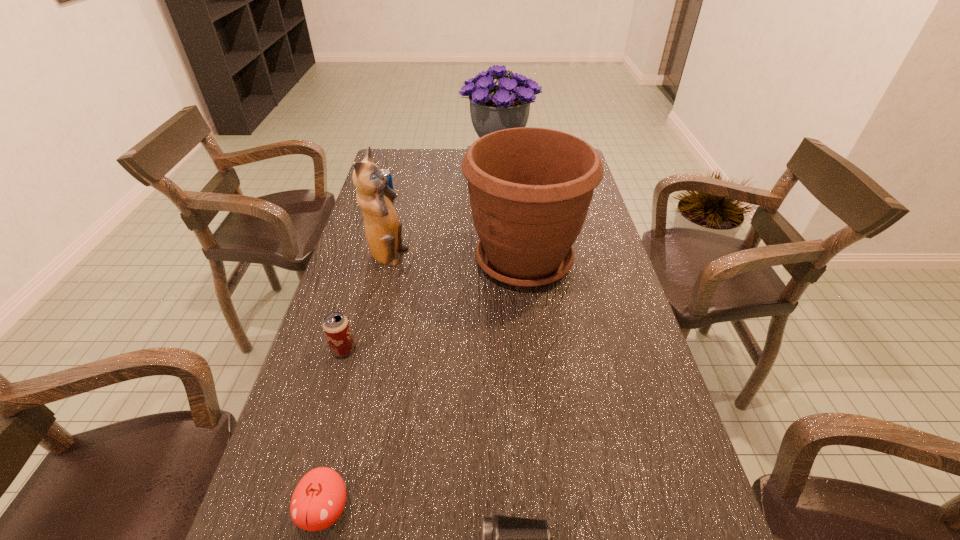
At what (x,y) coordinates should I click in order to perform the action: click on free spot between the pop soda and the flowerpot. Please return your answer as a coordinate pair (x, y). This screenshot has width=960, height=540. Looking at the image, I should click on (455, 230).

You are a GUI agent. You are given a task and a screenshot of the screen. Output one action in this format:
    pyautogui.click(x=<x>, y=<y>)
    Task: Click on the vacant space that is in between the flowerpot and the pop soda
    
    Given the screenshot: What is the action you would take?
    coord(455,230)

Image resolution: width=960 pixels, height=540 pixels. Find the location of `vacant area that lies between the cat and the bouquet`. vacant area that lies between the cat and the bouquet is located at coordinates (444, 212).

Identify the location of vacant space in between the bouquet and the cat. (444, 212).

Locate an element on the screen. object that can be found as the third closest to the farthest object is located at coordinates (383, 229).

Image resolution: width=960 pixels, height=540 pixels. Identify the location of the sixth closest object to the cat. pyautogui.click(x=505, y=539).

Where is `vacant region that satisfies the following two spatial constraints: 1. on the face of the flowerpot; 2. on the right side of the cat`? vacant region that satisfies the following two spatial constraints: 1. on the face of the flowerpot; 2. on the right side of the cat is located at coordinates (387, 260).

Where is `vacant space that satisfies the following two spatial constraints: 1. on the front side of the farthest object; 2. on the face of the cat`? The width and height of the screenshot is (960, 540). vacant space that satisfies the following two spatial constraints: 1. on the front side of the farthest object; 2. on the face of the cat is located at coordinates (505, 258).